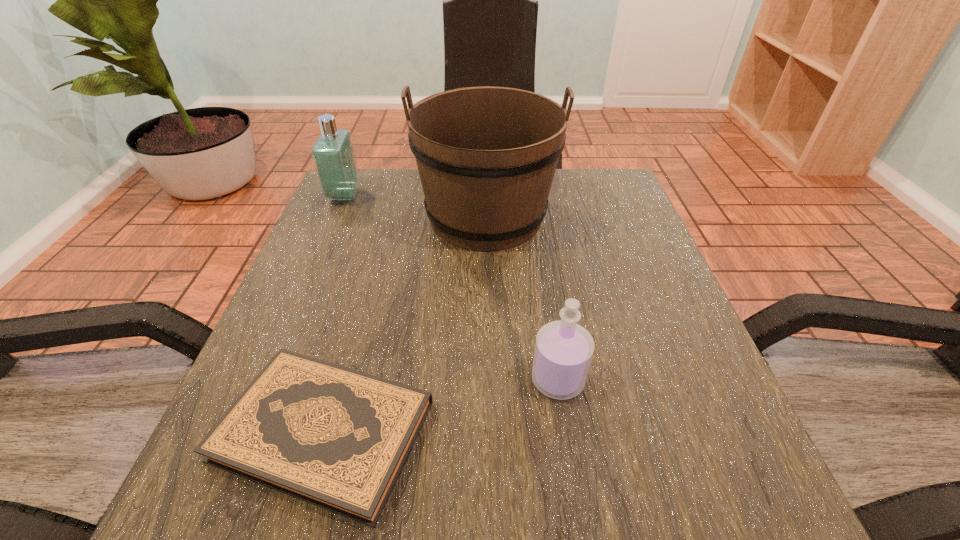
Where is `unoccupied position between the shortest object and the bucket`? The width and height of the screenshot is (960, 540). unoccupied position between the shortest object and the bucket is located at coordinates (405, 324).

Identify which object is located as the third nearest to the tallest object. Please provide its 2D coordinates. Your answer should be formatted as a tuple, i.e. [(x, y)], where the tuple contains the x and y coordinates of a point satisfying the conditions above.

[(338, 438)]

Identify the location of object that is the third nearest to the bucket. (338, 438).

Image resolution: width=960 pixels, height=540 pixels. I want to click on free space that satisfies the following two spatial constraints: 1. on the front label of the tallest object; 2. on the right side of the farther perfume, so click(335, 217).

At what (x,y) coordinates should I click in order to perform the action: click on vacant area in the image that satisfies the following two spatial constraints: 1. on the front label of the right perfume; 2. on the right side of the left perfume. Please return your answer as a coordinate pair (x, y). The image size is (960, 540). Looking at the image, I should click on (265, 380).

The width and height of the screenshot is (960, 540). I want to click on free spot that satisfies the following two spatial constraints: 1. on the front label of the farther perfume; 2. on the left side of the hardback book, so click(x=243, y=431).

Find the location of a particular element. This screenshot has width=960, height=540. vacant region that satisfies the following two spatial constraints: 1. on the front label of the nearer perfume; 2. on the left side of the left perfume is located at coordinates (265, 380).

Image resolution: width=960 pixels, height=540 pixels. What are the coordinates of `free point that satisfies the following two spatial constraints: 1. on the back side of the bucket; 2. on the front label of the left perfume` in the screenshot? It's located at (486, 195).

At what (x,y) coordinates should I click in order to perform the action: click on vacant space that satisfies the following two spatial constraints: 1. on the front label of the left perfume; 2. on the back side of the bucket. Please return your answer as a coordinate pair (x, y). Looking at the image, I should click on (335, 217).